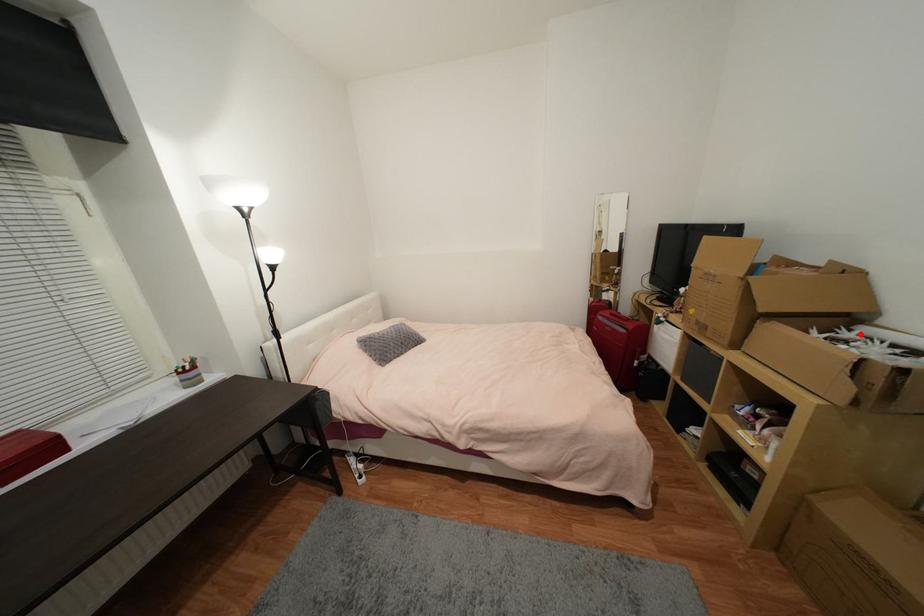
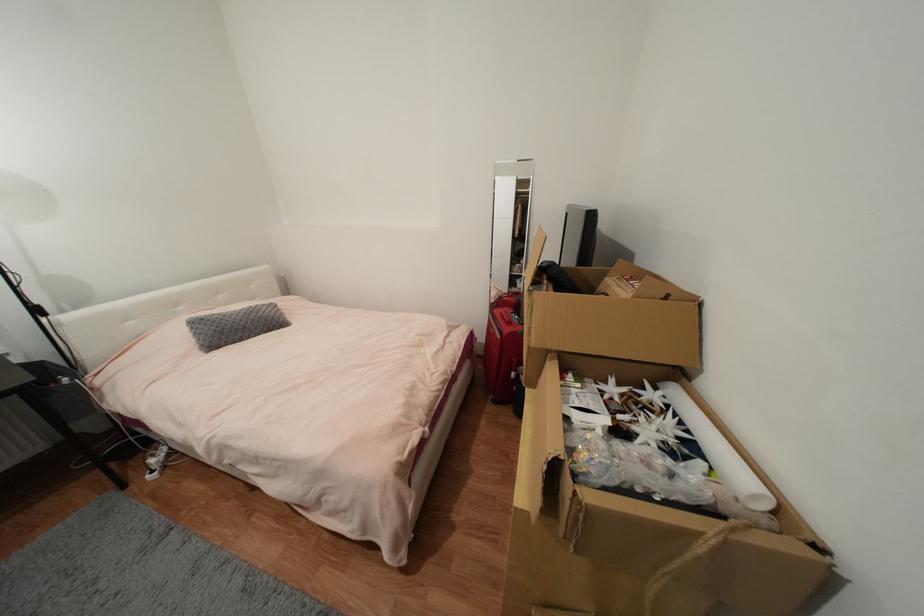
Locate, in the second image, the point that corresponds to the highlighted location in the first image.

(664, 394)